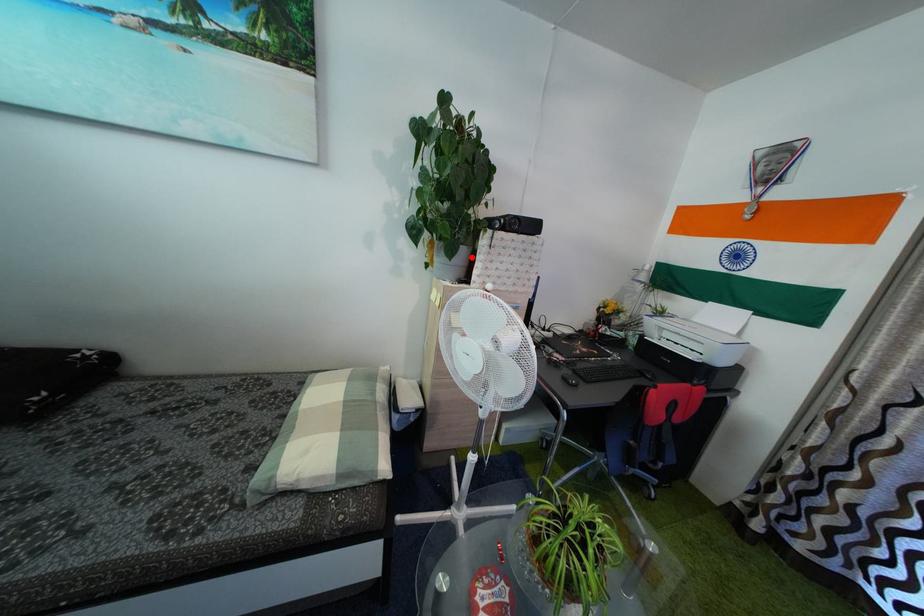
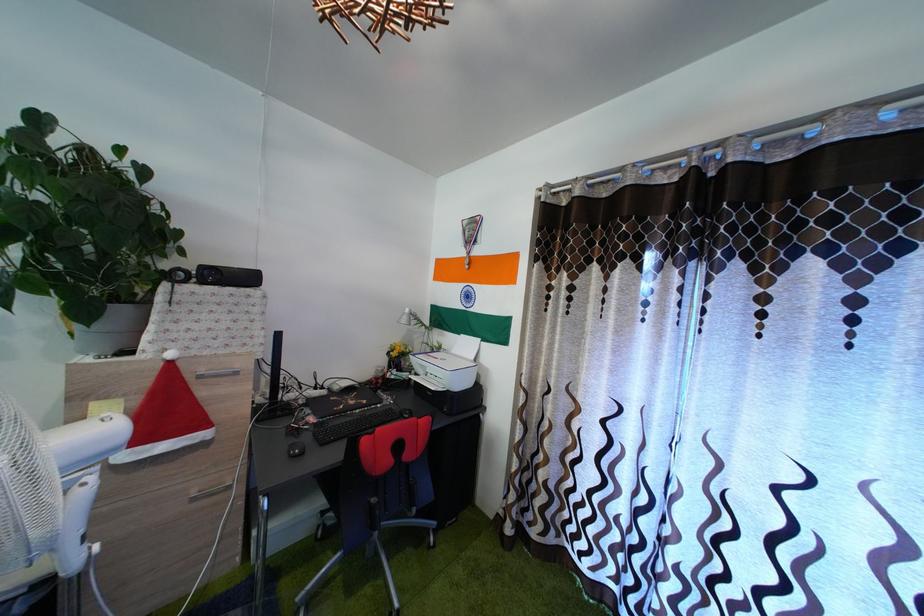
In the second image, find the point that corresponds to the highlighted location in the first image.

(128, 318)